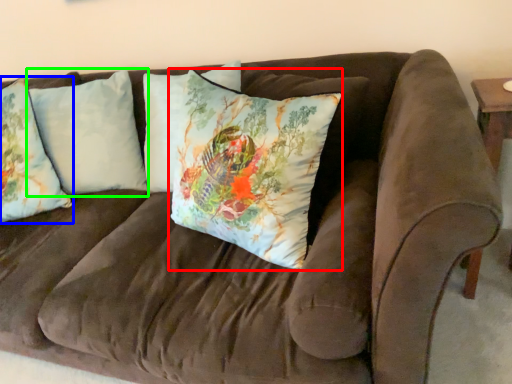
Question: Which object is the farthest from pillow (highlighted by a red box)? Choose among these: pillow (highlighted by a blue box) or pillow (highlighted by a green box).

Choices:
 (A) pillow
 (B) pillow

Answer: (A)